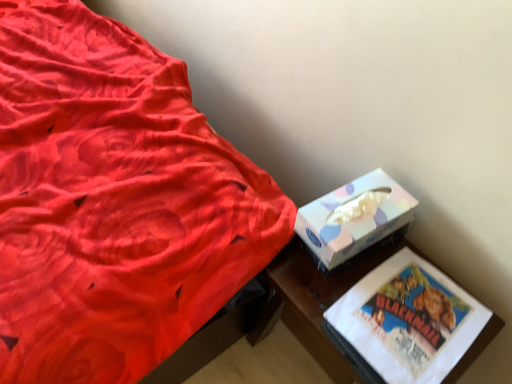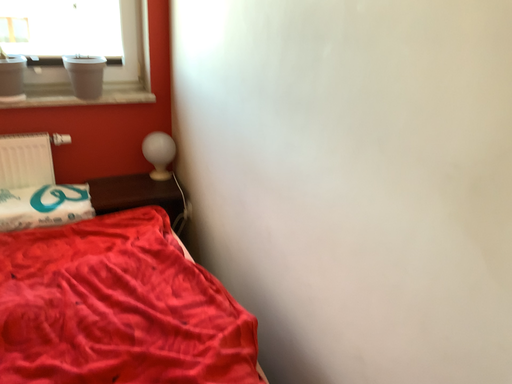
Question: Which way did the camera rotate in the video?

Choices:
 (A) rotated right
 (B) rotated left

Answer: (B)